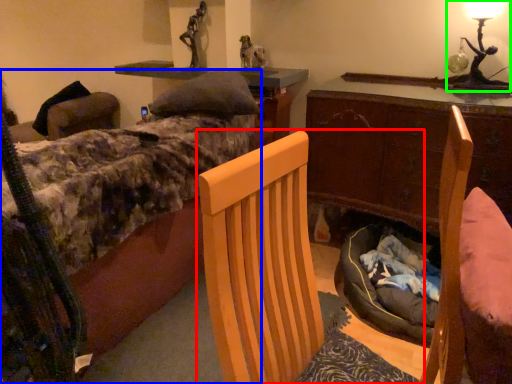
Question: Which object is the farthest from chair (highlighted by a red box)? Choose among these: bed (highlighted by a blue box) or table lamp (highlighted by a green box).

Choices:
 (A) bed
 (B) table lamp

Answer: (B)